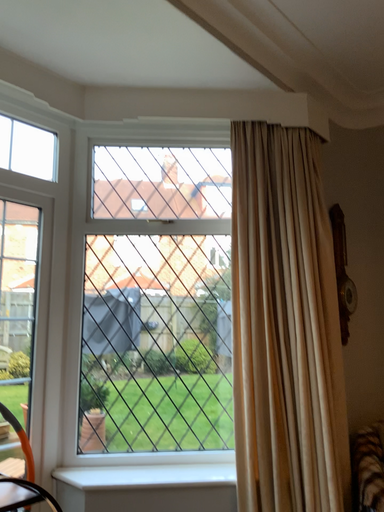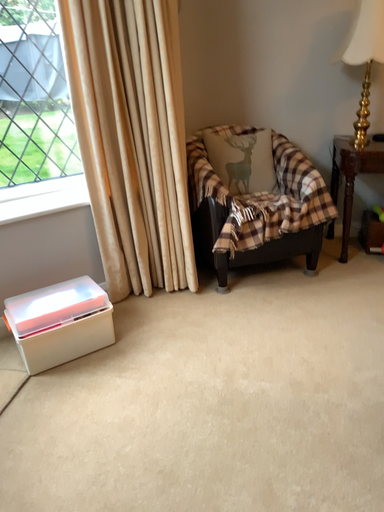
Question: Which way did the camera rotate in the video?

Choices:
 (A) rotated upward
 (B) rotated downward

Answer: (B)